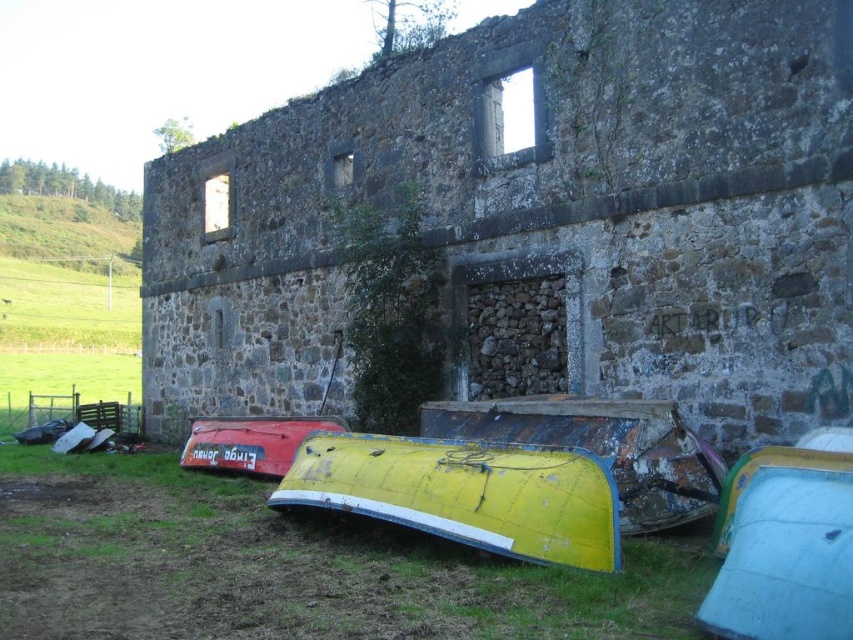
Question: Can you confirm if green grass at lower left is positioned above rusty metal boat at lower center?

Choices:
 (A) yes
 (B) no

Answer: (B)

Question: Which point is farther from the camera taking this photo?

Choices:
 (A) (230, 550)
 (B) (270, 452)
 (C) (448, 513)

Answer: (B)

Question: Is yellow matte boat at center smaller than rusty metal boat at lower center?

Choices:
 (A) yes
 (B) no

Answer: (A)

Question: Does green grass at lower left come in front of yellow matte boat at center?

Choices:
 (A) no
 (B) yes

Answer: (B)

Question: Among these points, which one is farthest from the camera?

Choices:
 (A) (607, 422)
 (B) (277, 444)
 (C) (648, 550)
 (D) (468, 460)

Answer: (B)

Question: Which of the following is the farthest from the observer?

Choices:
 (A) (292, 449)
 (B) (708, 513)
 (C) (448, 460)

Answer: (A)